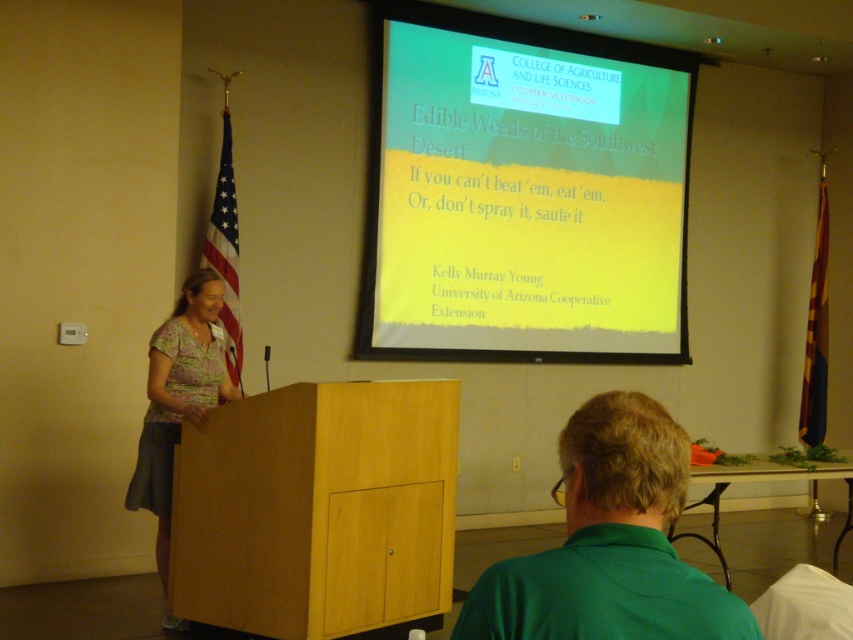
Question: Which point is closer to the camera?

Choices:
 (A) yellow matte projection screen at upper center
 (B) green fabric shirt at lower right
 (C) floral fabric blouse at left

Answer: (B)

Question: Among these points, which one is farthest from the camera?

Choices:
 (A) (613, 589)
 (B) (604, 326)

Answer: (B)

Question: Considering the real-world distances, which object is closest to the green fabric shirt at lower right?

Choices:
 (A) floral fabric blouse at left
 (B) yellow matte projection screen at upper center

Answer: (A)

Question: Does yellow matte projection screen at upper center have a lesser width compared to green fabric shirt at lower right?

Choices:
 (A) yes
 (B) no

Answer: (B)

Question: Can you confirm if green fabric shirt at lower right is bigger than floral fabric blouse at left?

Choices:
 (A) yes
 (B) no

Answer: (B)

Question: From the image, what is the correct spatial relationship of green fabric shirt at lower right in relation to floral fabric blouse at left?

Choices:
 (A) left
 (B) right

Answer: (B)